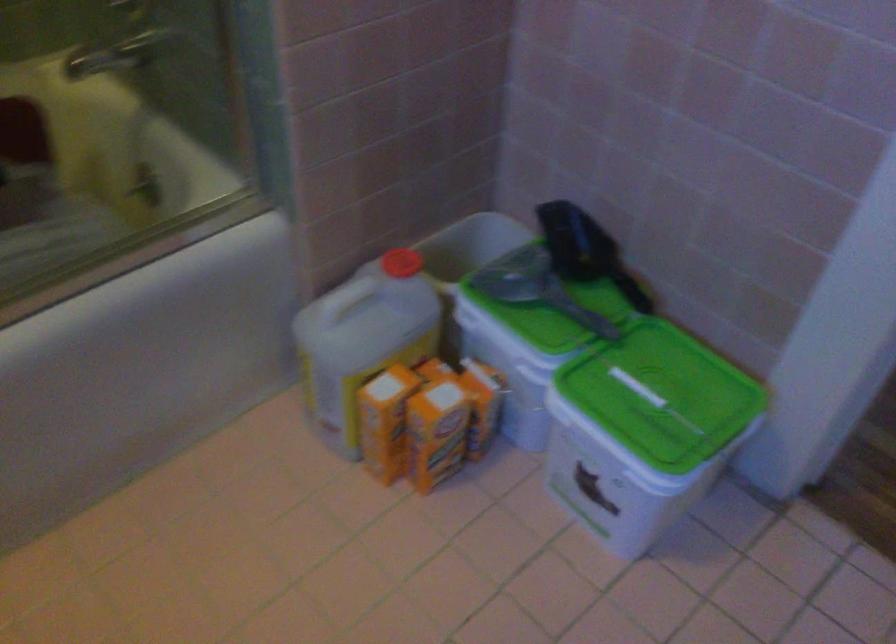
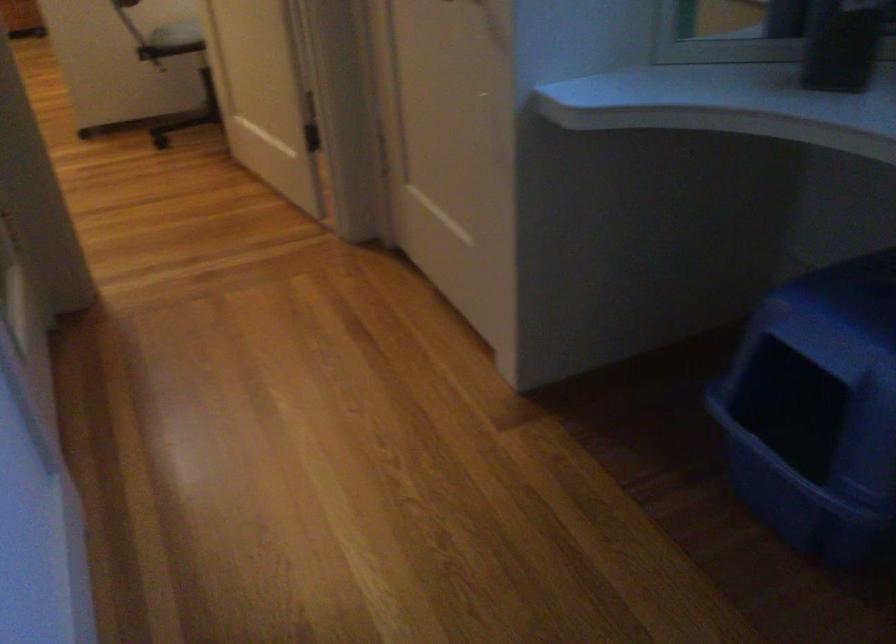
What movement of the cameraman would produce the second image?

The cameraman walked toward right, forward.